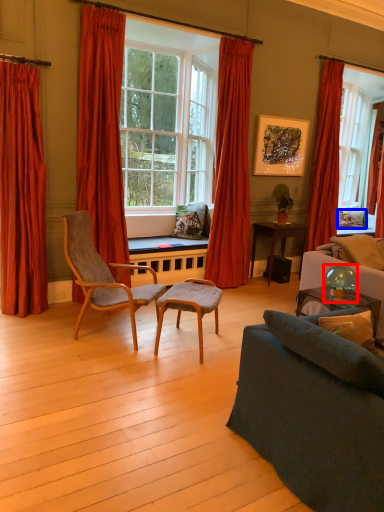
Question: Among these objects, which one is farthest to the camera, lamp (highlighted by a red box) or pillow (highlighted by a blue box)?

Choices:
 (A) lamp
 (B) pillow

Answer: (B)